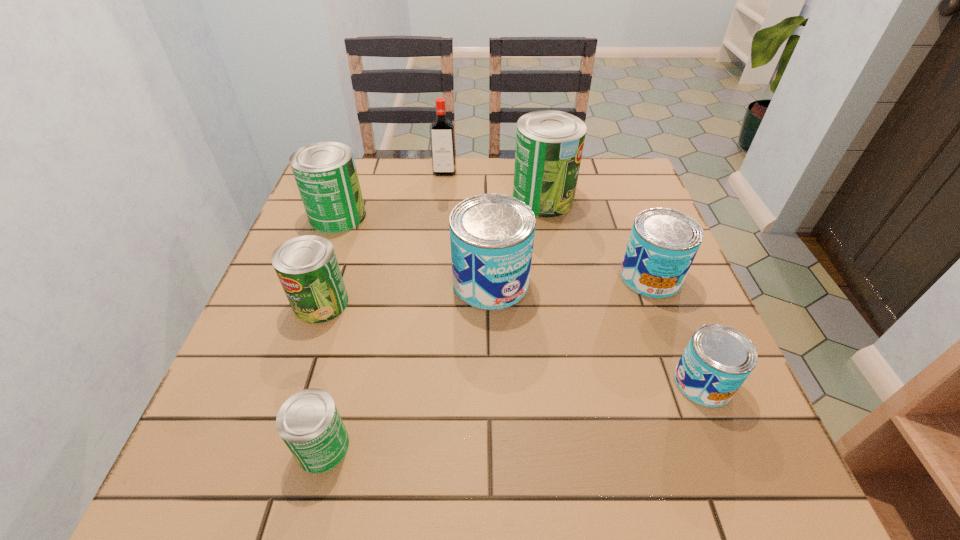
This screenshot has height=540, width=960. I want to click on the third closest green can relative to the rightmost green can, so click(309, 423).

You are a GUI agent. You are given a task and a screenshot of the screen. Output one action in this format:
    pyautogui.click(x=<x>, y=<y>)
    Task: Click on the blue can that is the second closest to the second biggest blue can
    Image resolution: width=960 pixels, height=540 pixels.
    Given the screenshot: What is the action you would take?
    pyautogui.click(x=491, y=235)

Select which blue can is the closest to the third smallest green can. Please provide its 2D coordinates. Your answer should be formatted as a tuple, i.e. [(x, y)], where the tuple contains the x and y coordinates of a point satisfying the conditions above.

[(491, 235)]

Find the location of a particular element. The width and height of the screenshot is (960, 540). free space that satisfies the following two spatial constraints: 1. on the front side of the third smallest green can; 2. on the right side of the second nearest green can is located at coordinates (305, 303).

Identify the location of vacant position in the image that satisfies the following two spatial constraints: 1. on the back side of the biggest green can; 2. on the left side of the third smallest green can. The image size is (960, 540). (345, 198).

At what (x,y) coordinates should I click in order to perform the action: click on free space that satisfies the following two spatial constraints: 1. on the front and back of the farthest object; 2. on the left side of the second biggest blue can. Please return your answer as a coordinate pair (x, y). The width and height of the screenshot is (960, 540). Looking at the image, I should click on (434, 277).

At what (x,y) coordinates should I click in order to perform the action: click on free space that satisfies the following two spatial constraints: 1. on the back side of the nearest green can; 2. on the right side of the seventh farthest object. Please return your answer as a coordinate pair (x, y). Looking at the image, I should click on (340, 383).